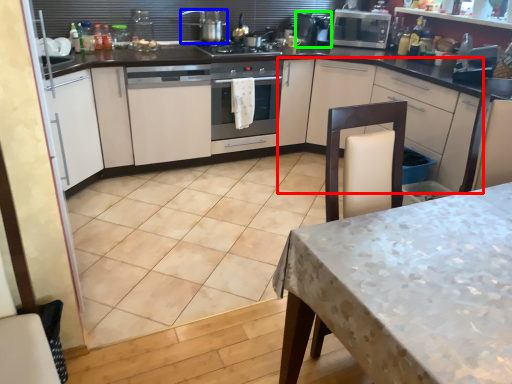
Question: Which object is positioned closest to cabinetry (highlighted by a red box)? Select from kitchen appliance (highlighted by a blue box) and appliance (highlighted by a green box).

Choices:
 (A) kitchen appliance
 (B) appliance

Answer: (B)